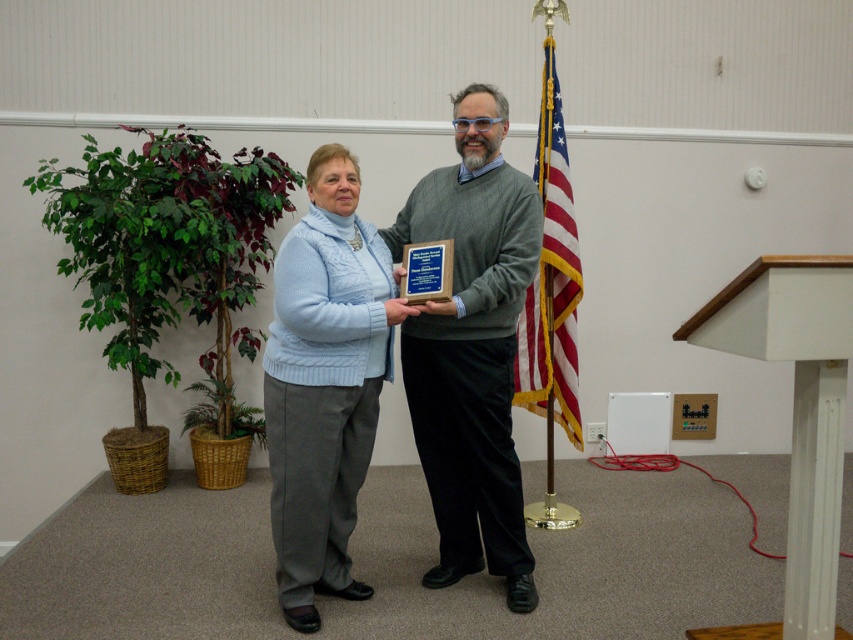
Is matte gray sweater at center thinner than white glossy podium at center?

Yes.

The height and width of the screenshot is (640, 853). What are the coordinates of `matte gray sweater at center` in the screenshot? It's located at click(473, 348).

Where is `matte gray sweater at center`? The width and height of the screenshot is (853, 640). matte gray sweater at center is located at coordinates (473, 348).

Is light blue sweater at center shorter than american flag at center?

Yes, light blue sweater at center is shorter than american flag at center.

Does light blue sweater at center have a lesser width compared to american flag at center?

Incorrect, light blue sweater at center's width is not less than american flag at center's.

Does point (341, 532) lie behind point (529, 330)?

No, (341, 532) is in front of (529, 330).

Locate an element on the screen. The width and height of the screenshot is (853, 640). light blue sweater at center is located at coordinates (323, 384).

Measure the distance from matte gray sweater at center to american flag at center.

matte gray sweater at center is 33.46 inches from american flag at center.

Image resolution: width=853 pixels, height=640 pixels. Describe the element at coordinates (473, 348) in the screenshot. I see `matte gray sweater at center` at that location.

This screenshot has height=640, width=853. What are the coordinates of `matte gray sweater at center` in the screenshot? It's located at (473, 348).

Find the location of a particular element. The width and height of the screenshot is (853, 640). matte gray sweater at center is located at coordinates (473, 348).